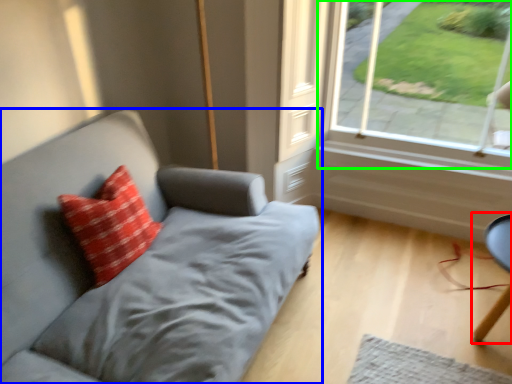
Question: Which object is positioned closest to computer chair (highlighted by a red box)? Select from studio couch (highlighted by a blue box) and window (highlighted by a green box).

Choices:
 (A) studio couch
 (B) window

Answer: (B)